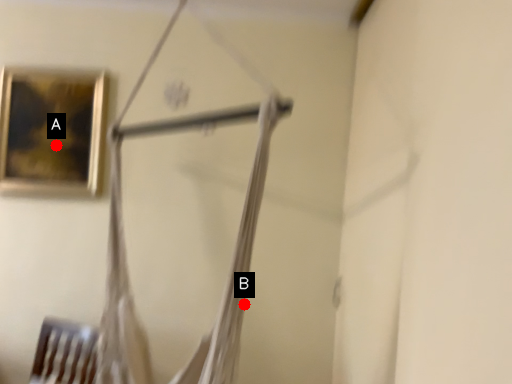
Question: Two points are circled on the image, labeled by A and B beside each circle. Which point is closer to the camera taking this photo?

Choices:
 (A) A is closer
 (B) B is closer

Answer: (B)